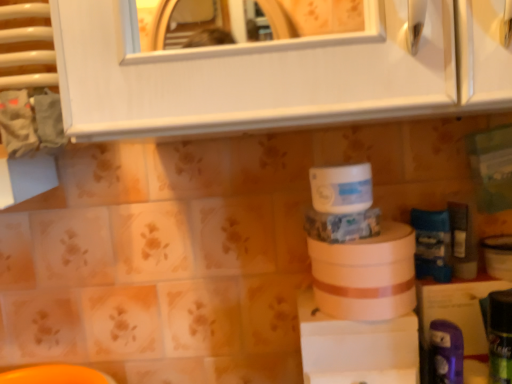
Question: From the image's perspective, is green matte can at lower right, the 4th toiletry from the back, above white matte toilet paper at center, which is counted as the second toilet paper, starting from the top?

Choices:
 (A) no
 (B) yes

Answer: (A)

Question: Can you confirm if green matte can at lower right, the first toiletry viewed from the front, is taller than white matte toilet paper at center, acting as the 1th toilet paper starting from the bottom?

Choices:
 (A) yes
 (B) no

Answer: (A)

Question: Is green matte can at lower right, the first toiletry viewed from the front, closer to camera compared to white matte toilet paper at center, acting as the 1th toilet paper starting from the bottom?

Choices:
 (A) no
 (B) yes

Answer: (B)

Question: Is white matte toilet paper at center, which is counted as the second toilet paper, starting from the top, at the back of green matte can at lower right, the first toiletry viewed from the front?

Choices:
 (A) no
 (B) yes

Answer: (A)

Question: Is green matte can at lower right, the first toiletry viewed from the front, in contact with white matte toilet paper at center, which is counted as the second toilet paper, starting from the top?

Choices:
 (A) yes
 (B) no

Answer: (B)

Question: Considering their positions, is purple plastic toothbrush at lower right, which appears as the 2th toiletry when viewed from the front, located in front of or behind blue matte toothpaste tube at right, the 1th toiletry in the back-to-front sequence?

Choices:
 (A) front
 (B) behind

Answer: (A)

Question: Considering the positions of purple plastic toothbrush at lower right, the 3th toiletry viewed from the back, and blue matte toothpaste tube at right, which ranks as the fourth toiletry in front-to-back order, in the image, is purple plastic toothbrush at lower right, the 3th toiletry viewed from the back, bigger or smaller than blue matte toothpaste tube at right, which ranks as the fourth toiletry in front-to-back order,?

Choices:
 (A) small
 (B) big

Answer: (A)

Question: Considering the positions of point (457, 336) and point (420, 271), is point (457, 336) closer or farther from the camera than point (420, 271)?

Choices:
 (A) closer
 (B) farther

Answer: (A)

Question: Considering the positions of purple plastic toothbrush at lower right, which appears as the 2th toiletry when viewed from the front, and blue matte toothpaste tube at right, which ranks as the fourth toiletry in front-to-back order, in the image, is purple plastic toothbrush at lower right, which appears as the 2th toiletry when viewed from the front, wider or thinner than blue matte toothpaste tube at right, which ranks as the fourth toiletry in front-to-back order,?

Choices:
 (A) thin
 (B) wide

Answer: (A)

Question: Is white matte jar at center, the 2th toilet paper positioned from the bottom, wider or thinner than green matte can at lower right, the 4th toiletry from the back?

Choices:
 (A) wide
 (B) thin

Answer: (A)

Question: Considering the positions of white matte jar at center, the 2th toilet paper positioned from the bottom, and green matte can at lower right, the first toiletry viewed from the front, in the image, is white matte jar at center, the 2th toilet paper positioned from the bottom, taller or shorter than green matte can at lower right, the first toiletry viewed from the front,?

Choices:
 (A) tall
 (B) short

Answer: (B)

Question: Is white matte jar at center, the first toilet paper viewed from the top, to the left or to the right of green matte can at lower right, the first toiletry viewed from the front, in the image?

Choices:
 (A) left
 (B) right

Answer: (A)

Question: Does point (338, 165) appear closer or farther from the camera than point (510, 370)?

Choices:
 (A) closer
 (B) farther

Answer: (B)

Question: Is purple plastic toothbrush at lower right, the 3th toiletry viewed from the back, taller or shorter than white matte toilet paper at center, which is counted as the second toilet paper, starting from the top?

Choices:
 (A) tall
 (B) short

Answer: (B)

Question: Looking at their shapes, would you say purple plastic toothbrush at lower right, which appears as the 2th toiletry when viewed from the front, is wider or thinner than white matte toilet paper at center, acting as the 1th toilet paper starting from the bottom?

Choices:
 (A) thin
 (B) wide

Answer: (A)